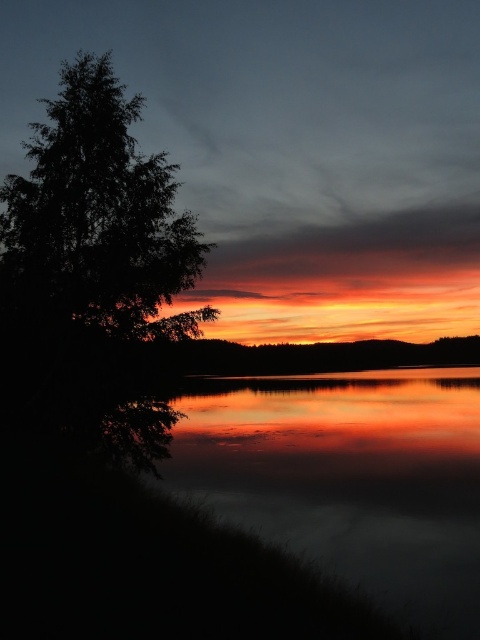
Question: Among these points, which one is nearest to the camera?

Choices:
 (A) (29, 218)
 (B) (466, 598)

Answer: (B)

Question: Can you confirm if reflective glass water at lower left is positioned to the right of dark green leafy tree at left?

Choices:
 (A) yes
 (B) no

Answer: (A)

Question: Among these points, which one is nearest to the camera?

Choices:
 (A) tap(131, 157)
 (B) tap(305, 472)

Answer: (A)

Question: Which point is closer to the camera taking this photo?

Choices:
 (A) (147, 237)
 (B) (254, 509)

Answer: (B)

Question: Is the position of reflective glass water at lower left less distant than that of dark green leafy tree at left?

Choices:
 (A) yes
 (B) no

Answer: (A)

Question: Does reflective glass water at lower left have a lesser width compared to dark green leafy tree at left?

Choices:
 (A) yes
 (B) no

Answer: (B)